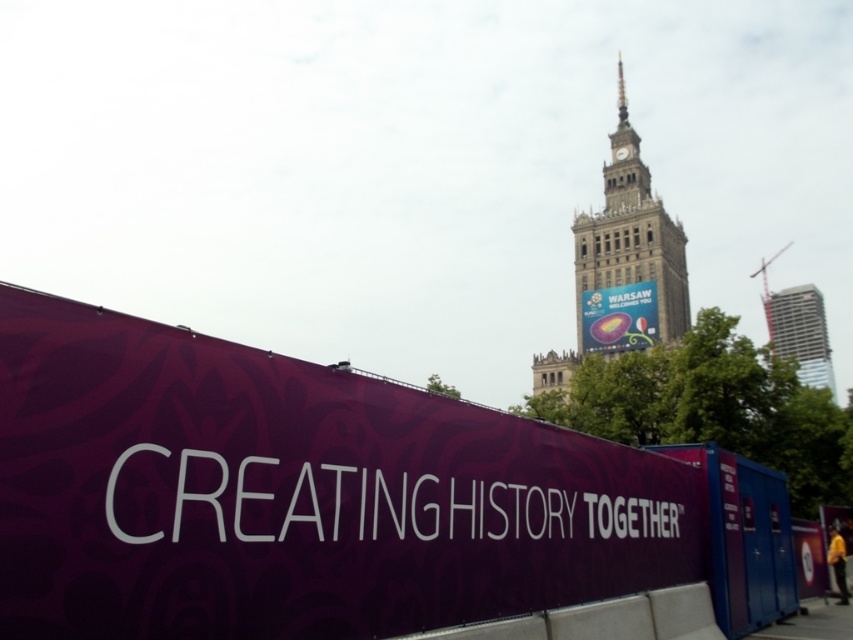
Question: Which point appears closest to the camera in this image?

Choices:
 (A) click(x=608, y=228)
 (B) click(x=775, y=321)

Answer: (A)

Question: Estimate the real-world distances between objects in this image. Which object is closer to the metallic glass skyscraper at upper right?

Choices:
 (A) purple matte banner at center
 (B) matte purple banner at center

Answer: (B)

Question: Is metallic glass skyscraper at upper right wider than matte purple banner at center?

Choices:
 (A) yes
 (B) no

Answer: (A)

Question: Can you confirm if purple matte banner at center is positioned to the left of metallic glass skyscraper at upper right?

Choices:
 (A) yes
 (B) no

Answer: (A)

Question: Can you confirm if purple matte banner at center is wider than metallic glass skyscraper at upper right?

Choices:
 (A) yes
 (B) no

Answer: (B)

Question: Which object is closer to the camera taking this photo?

Choices:
 (A) stone clock tower at center
 (B) matte purple banner at center
 (C) purple matte banner at center
 (D) metallic glass skyscraper at upper right

Answer: (C)